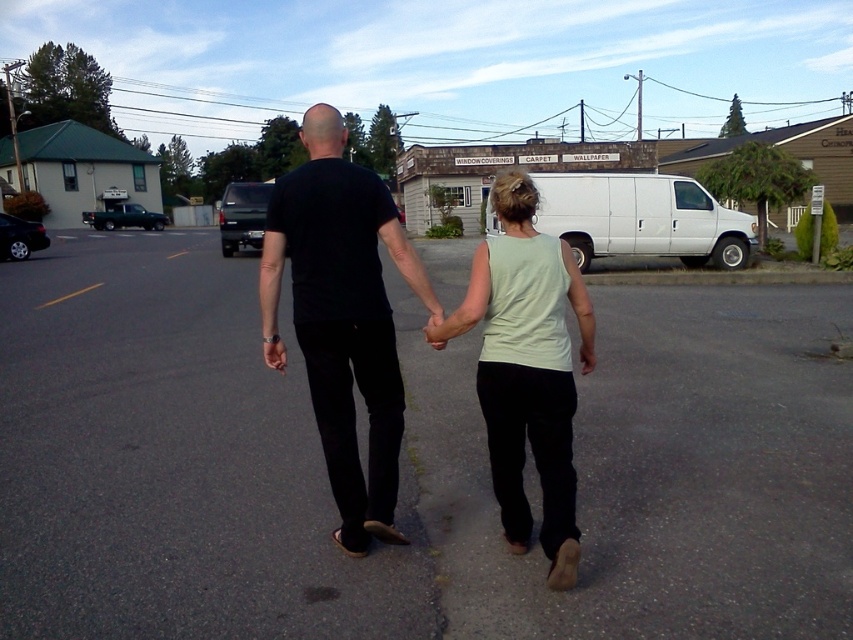
Who is higher up, black matte shirt at center or matte black hand at center?

black matte shirt at center is higher up.

Is black matte shirt at center taller than matte black hand at center?

Correct, black matte shirt at center is much taller as matte black hand at center.

Find the location of a particular element. The height and width of the screenshot is (640, 853). black matte shirt at center is located at coordinates (341, 317).

Who is positioned more to the left, black matte shirt at center or light green sleeveless top at center?

From the viewer's perspective, black matte shirt at center appears more on the left side.

Does black matte shirt at center lie in front of light green sleeveless top at center?

That is False.

Which is behind, point (337, 182) or point (486, 372)?

The point (337, 182) is more distant.

Where is `black matte shirt at center`? The width and height of the screenshot is (853, 640). black matte shirt at center is located at coordinates (341, 317).

Is light green sleeveless top at center wider than matte black hand at center?

Correct, the width of light green sleeveless top at center exceeds that of matte black hand at center.

Who is more forward, (x=479, y=362) or (x=428, y=314)?

Point (x=479, y=362)

Describe the element at coordinates (527, 369) in the screenshot. I see `light green sleeveless top at center` at that location.

This screenshot has height=640, width=853. Find the location of `light green sleeveless top at center`. light green sleeveless top at center is located at coordinates (527, 369).